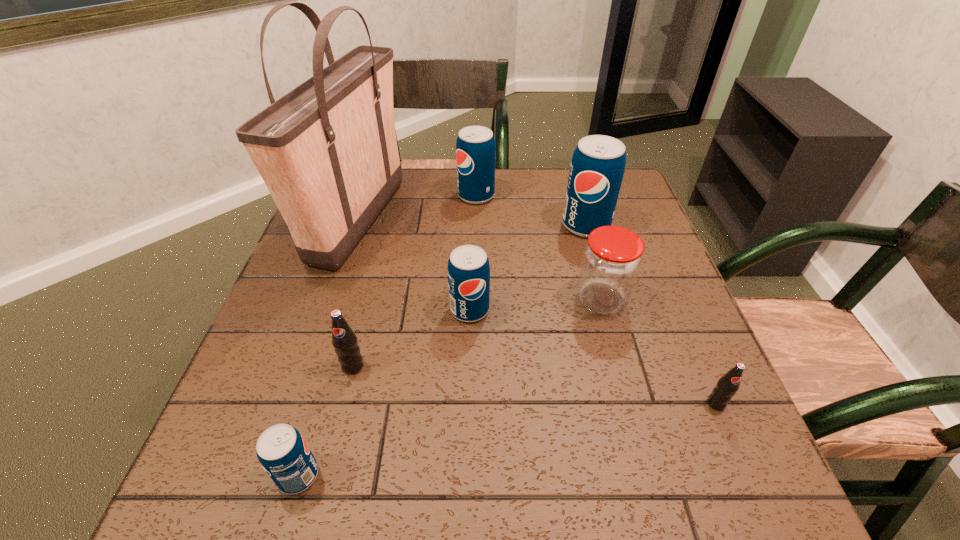
Locate an element on the screen. The image size is (960, 540). unoccupied area between the left black pop and the jar is located at coordinates (477, 333).

You are a GUI agent. You are given a task and a screenshot of the screen. Output one action in this format:
    pyautogui.click(x=<x>, y=<y>)
    Task: Click on the free spot between the tallest object and the nearer black pop
    This screenshot has width=960, height=540.
    Given the screenshot: What is the action you would take?
    pyautogui.click(x=538, y=312)

Find the location of a particular element. This screenshot has width=960, height=540. empty location between the fifth shortest pop and the smallest blue pop is located at coordinates (387, 335).

Find the location of a particular element. The height and width of the screenshot is (540, 960). vacant space that's between the shopping bag and the fourth nearest pop is located at coordinates (415, 265).

Locate which object ranks in proximity to the fourth farthest pop. Please provide its 2D coordinates. Your answer should be formatted as a tuple, i.e. [(x, y)], where the tuple contains the x and y coordinates of a point satisfying the conditions above.

[(282, 451)]

Locate an element on the screen. object that is the second closest to the farthest blue pop is located at coordinates click(x=597, y=168).

Choose which pop is the fourth nearest neighbor to the jar. Please provide its 2D coordinates. Your answer should be formatted as a tuple, i.e. [(x, y)], where the tuple contains the x and y coordinates of a point satisfying the conditions above.

[(475, 146)]

The height and width of the screenshot is (540, 960). Find the location of `pop identified as the fourth closest to the fourth nearest pop`. pop identified as the fourth closest to the fourth nearest pop is located at coordinates (475, 146).

Select which blue pop is the closest to the nearest blue pop. Please provide its 2D coordinates. Your answer should be formatted as a tuple, i.e. [(x, y)], where the tuple contains the x and y coordinates of a point satisfying the conditions above.

[(468, 270)]

The width and height of the screenshot is (960, 540). Find the location of `the closest blue pop relative to the smaller black pop`. the closest blue pop relative to the smaller black pop is located at coordinates (468, 270).